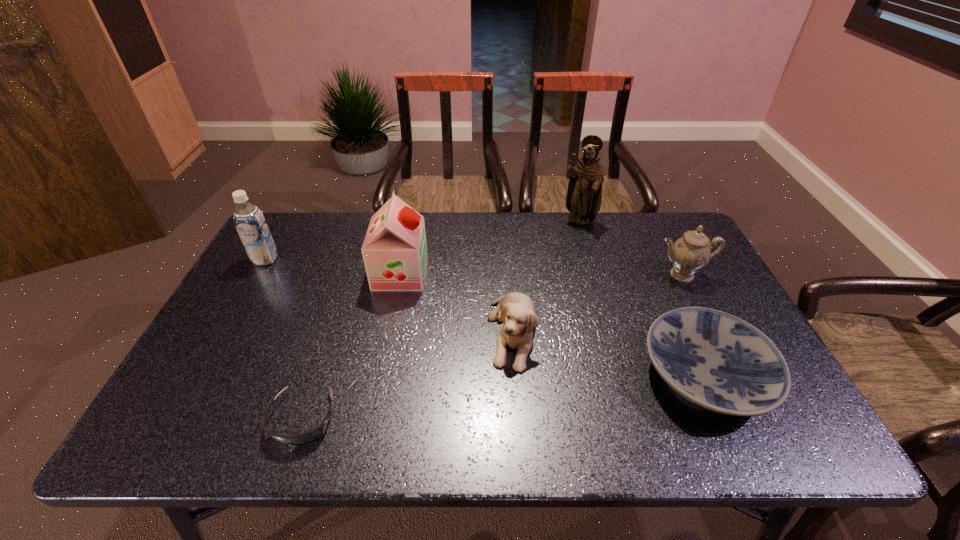
Locate an element on the screen. the farthest object is located at coordinates (584, 194).

This screenshot has width=960, height=540. In order to click on the tallest object in this screenshot , I will do [584, 194].

Where is `the right soya milk`? the right soya milk is located at coordinates (394, 250).

Where is `the leftmost object`? The width and height of the screenshot is (960, 540). the leftmost object is located at coordinates (251, 225).

The height and width of the screenshot is (540, 960). Find the location of `the fourth tallest object`. the fourth tallest object is located at coordinates (690, 253).

Where is `the third shortest object`? the third shortest object is located at coordinates (516, 310).

I want to click on the fourth object from left to right, so click(x=516, y=310).

Locate an element on the screen. This screenshot has width=960, height=540. plate is located at coordinates (718, 361).

Identify the location of the second object from left to right. This screenshot has width=960, height=540. (300, 439).

Identify the location of goggles. The image size is (960, 540). (300, 439).